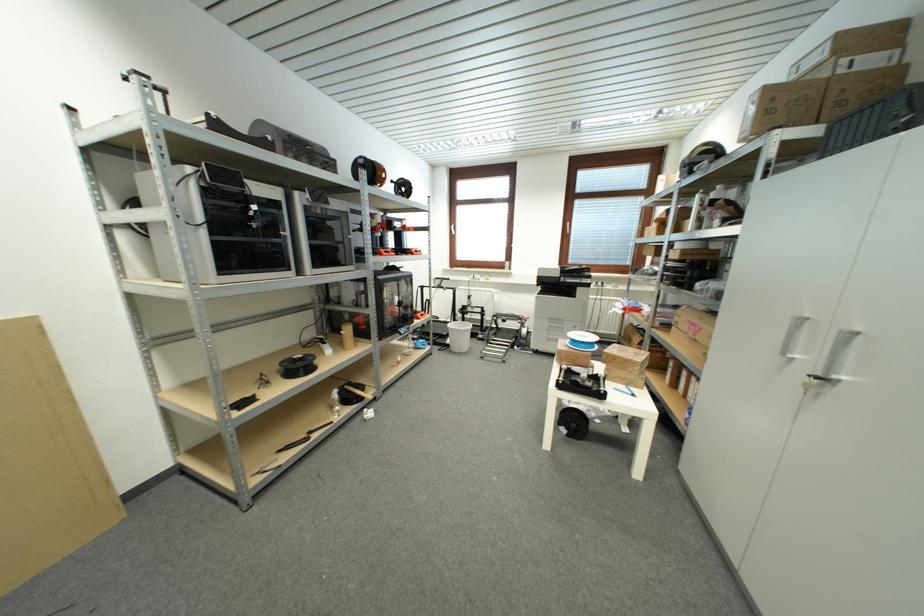
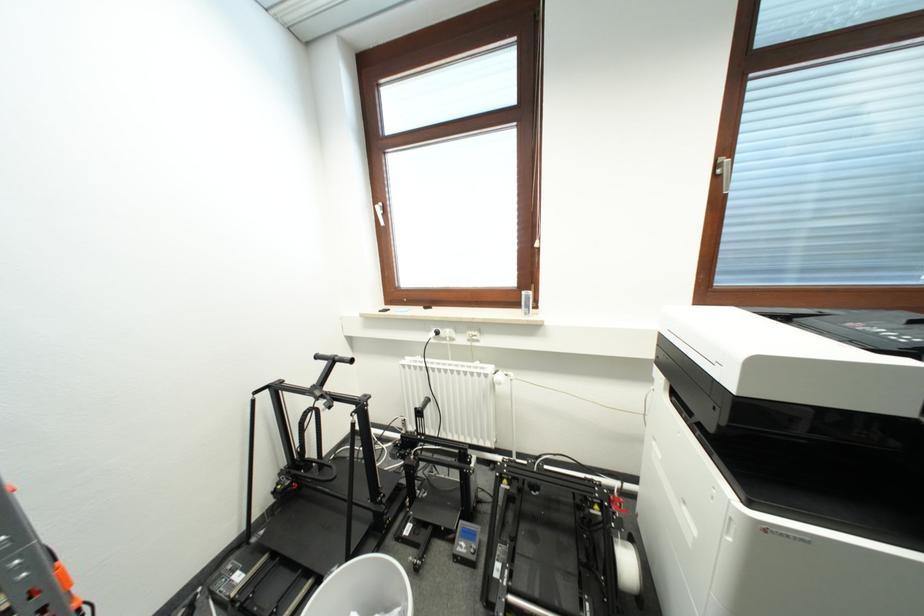
Where in the second image is the point corresponding to the point at 456,228 from the first image?

(379, 206)